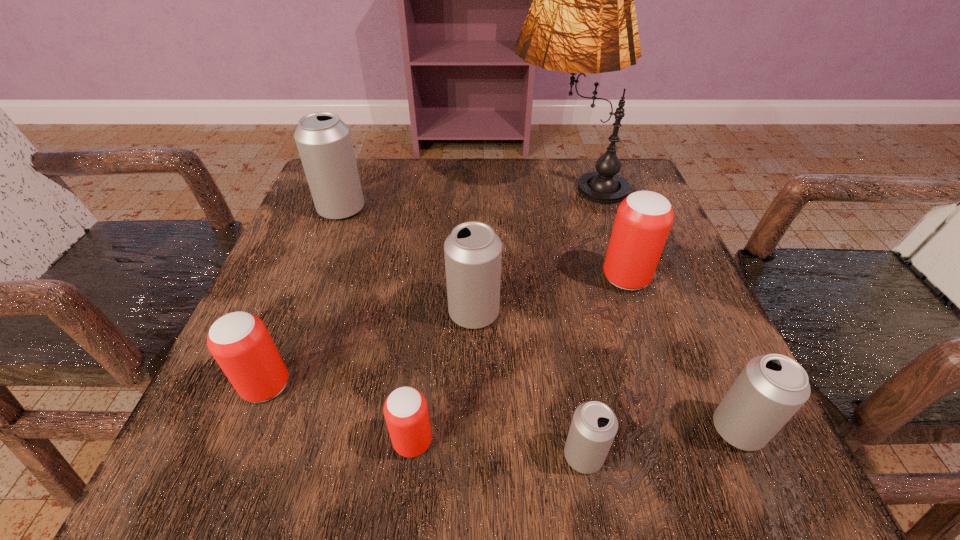
At what (x,y) coordinates should I click in order to perform the action: click on free space between the leftmost red beer can and the biggest red beer can. Please return your answer as a coordinate pair (x, y). Looking at the image, I should click on (445, 332).

The image size is (960, 540). I want to click on free area in between the second farthest white beer can and the rightmost white beer can, so click(x=606, y=370).

Identify the location of vacant region between the second biggest white beer can and the rightmost beer can. The image size is (960, 540). (606, 370).

Identify the location of free space between the second smallest white beer can and the second white beer can from right to left. (660, 442).

The width and height of the screenshot is (960, 540). In order to click on free spot between the second white beer can from right to left and the sixth beer can from left to right in this screenshot , I will do `click(605, 367)`.

Identify the location of free space between the farthest red beer can and the second biggest red beer can. (445, 332).

Identify the location of vacant space in between the second smallest white beer can and the farthest red beer can. (682, 354).

You are a GUI agent. You are given a task and a screenshot of the screen. Output one action in this format:
    pyautogui.click(x=<x>, y=<y>)
    Task: Click on the third closest object to the second smallest red beer can
    Image resolution: width=960 pixels, height=540 pixels.
    Given the screenshot: What is the action you would take?
    pyautogui.click(x=324, y=143)

Select which object is the seventh closest to the third white beer can from left to right. Please provide its 2D coordinates. Your answer should be formatted as a tuple, i.e. [(x, y)], where the tuple contains the x and y coordinates of a point satisfying the conditions above.

[(324, 143)]

Identify which beer can is the sixth closest to the third object from left to right. Please provide its 2D coordinates. Your answer should be formatted as a tuple, i.e. [(x, y)], where the tuple contains the x and y coordinates of a point satisfying the conditions above.

[(324, 143)]